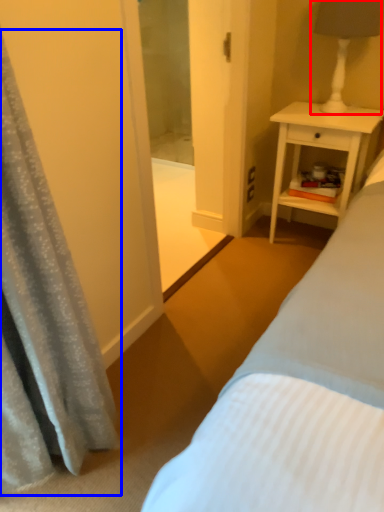
Question: Which point is closer to the camera, bedside lamp (highlighted by a red box) or curtain (highlighted by a blue box)?

Choices:
 (A) bedside lamp
 (B) curtain

Answer: (B)